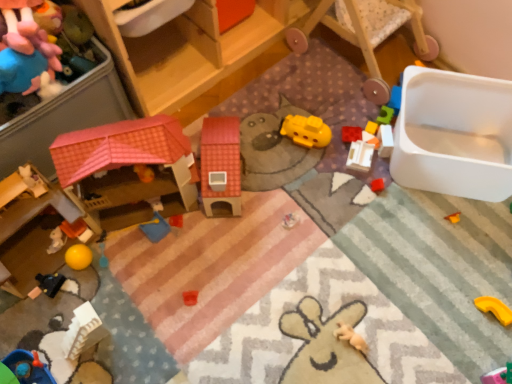
What are the coordinates of `vacant space in front of yellow rubber toy at lower right, positioned as the 11th toy in left-to-right order` in the screenshot? It's located at pyautogui.click(x=488, y=353).